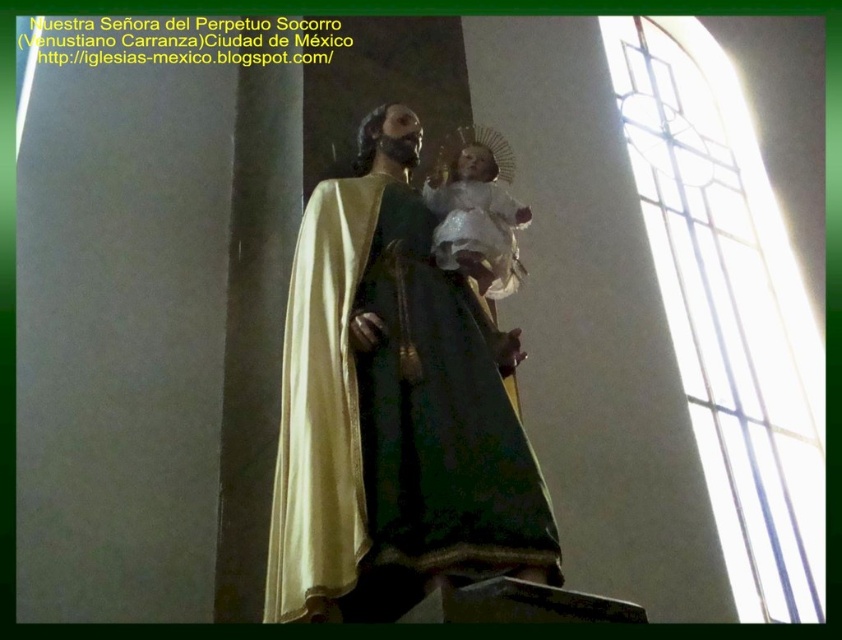
Question: Where is gold polished statue at center located in relation to white porcelain baby at center in the image?

Choices:
 (A) above
 (B) below

Answer: (B)

Question: Is gold polished statue at center thinner than white porcelain baby at center?

Choices:
 (A) yes
 (B) no

Answer: (B)

Question: Which of the following is the closest to the observer?

Choices:
 (A) (512, 244)
 (B) (393, 337)

Answer: (B)

Question: Does gold polished statue at center come behind white porcelain baby at center?

Choices:
 (A) yes
 (B) no

Answer: (B)